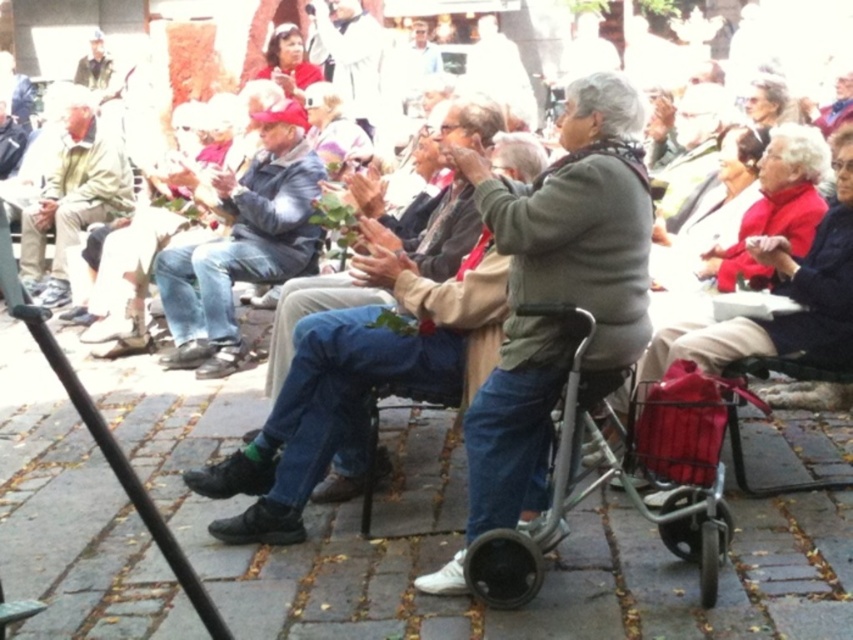
Which of these two, khaki cotton pants at left or metallic black walker at lower left, stands taller?

Standing taller between the two is khaki cotton pants at left.

Who is more forward, (20, 224) or (157, 532)?

Positioned in front is point (157, 532).

Find the location of a particular element. This screenshot has width=853, height=640. khaki cotton pants at left is located at coordinates (73, 196).

Where is `khaki cotton pants at left`? Image resolution: width=853 pixels, height=640 pixels. khaki cotton pants at left is located at coordinates tap(73, 196).

Is metallic gray walker at center to the left of metallic black walker at lower left from the viewer's perspective?

No, metallic gray walker at center is not to the left of metallic black walker at lower left.

Is metallic gray walker at center above metallic black walker at lower left?

No, metallic gray walker at center is not above metallic black walker at lower left.

Between point (682, 394) and point (71, 371), which one is positioned in front?

Point (71, 371)

The height and width of the screenshot is (640, 853). Find the location of `metallic gray walker at center`. metallic gray walker at center is located at coordinates (618, 477).

Measure the distance between metallic gray walker at center and camera.

metallic gray walker at center is 9.46 meters from camera.

The height and width of the screenshot is (640, 853). In order to click on metallic gray walker at center in this screenshot , I will do `click(618, 477)`.